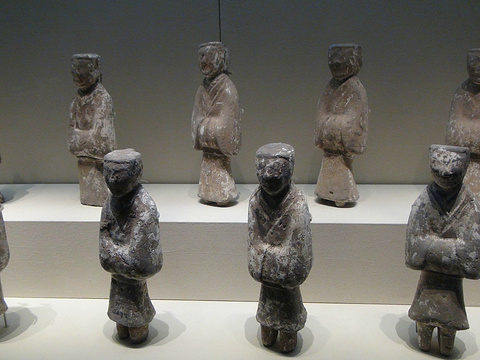
The image size is (480, 360). Find the location of `brown statue`. brown statue is located at coordinates (467, 120), (360, 118), (232, 126), (102, 118).